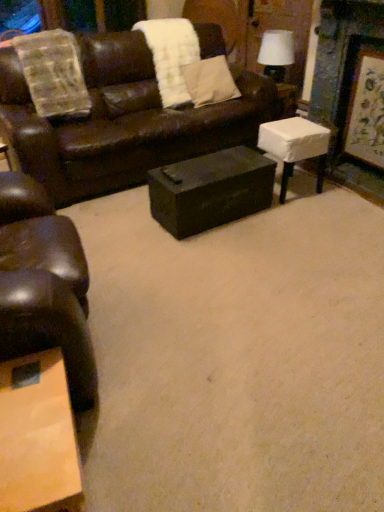
Image resolution: width=384 pixels, height=512 pixels. What do you see at coordinates (122, 121) in the screenshot?
I see `brown leather couch at upper center` at bounding box center [122, 121].

What do you see at coordinates (211, 190) in the screenshot? I see `matte black trunk at center, the second table when ordered from right to left` at bounding box center [211, 190].

What do you see at coordinates (276, 53) in the screenshot?
I see `white fabric lampshade at upper right` at bounding box center [276, 53].

This screenshot has width=384, height=512. In order to click on white fabric-covered stool at right, the 1th table viewed from the right in this screenshot , I will do `click(295, 146)`.

This screenshot has height=512, width=384. I want to click on shiny brown leather chair at left, so click(44, 284).

The height and width of the screenshot is (512, 384). In order to click on brown leather couch at upper center in this screenshot , I will do `click(122, 121)`.

In terms of width, does white fluffy blanket at upper center look wider or thinner when compared to shiny brown leather chair at left?

white fluffy blanket at upper center is wider than shiny brown leather chair at left.

Consider the image. Considering the relative positions of white fluffy blanket at upper center and shiny brown leather chair at left in the image provided, is white fluffy blanket at upper center in front of shiny brown leather chair at left?

No, it is not.

Considering the relative positions of white fluffy blanket at upper center and shiny brown leather chair at left in the image provided, is white fluffy blanket at upper center to the left of shiny brown leather chair at left from the viewer's perspective?

In fact, white fluffy blanket at upper center is to the right of shiny brown leather chair at left.

Is white fluffy blanket at upper center next to shiny brown leather chair at left?

No, white fluffy blanket at upper center is not beside shiny brown leather chair at left.

Is wooden framed artwork at right outside of white fabric lampshade at upper right?

Yes, wooden framed artwork at right is located beyond the bounds of white fabric lampshade at upper right.

From a real-world perspective, which object rests below the other?

wooden framed artwork at right is physically lower.

How far apart are wooden framed artwork at right and white fabric lampshade at upper right?

A distance of 37.02 inches exists between wooden framed artwork at right and white fabric lampshade at upper right.

In the scene shown: How different are the orientations of brown leather couch at upper center and matte black trunk at center, the second table when ordered from right to left, in degrees?

The angle between the facing direction of brown leather couch at upper center and the facing direction of matte black trunk at center, the second table when ordered from right to left, is 3.17 degrees.

Which is more to the right, brown leather couch at upper center or matte black trunk at center, positioned as the 1th table in left-to-right order?

From the viewer's perspective, matte black trunk at center, positioned as the 1th table in left-to-right order, appears more on the right side.

From a real-world perspective, relative to matte black trunk at center, positioned as the 1th table in left-to-right order, is brown leather couch at upper center vertically above or below?

brown leather couch at upper center is above matte black trunk at center, positioned as the 1th table in left-to-right order.

Are brown leather couch at upper center and matte black trunk at center, the second table when ordered from right to left, located far from each other?

No.

From the image's perspective, between shiny brown leather chair at left and white fluffy blanket at upper center, which one is located above?

white fluffy blanket at upper center.

Is white fluffy blanket at upper center a part of shiny brown leather chair at left?

No, white fluffy blanket at upper center is not a part of shiny brown leather chair at left.

From a real-world perspective, who is located higher, shiny brown leather chair at left or white fluffy blanket at upper center?

white fluffy blanket at upper center is physically above.

Is shiny brown leather chair at left further to the viewer compared to white fluffy blanket at upper center?

No, it is not.

Identify the location of throw pillow that is above the brown leather couch at upper center (from a real-world perspective). (209, 81).

From the image's perspective, who appears lower, beige fabric pillow at upper center or brown leather couch at upper center?

brown leather couch at upper center is shown below in the image.

Is the position of beige fabric pillow at upper center more distant than that of brown leather couch at upper center?

Yes, beige fabric pillow at upper center is behind brown leather couch at upper center.

From the image's perspective, who appears lower, wooden framed artwork at right or beige fabric pillow at upper center?

From the image's view, wooden framed artwork at right is below.

In the image, is wooden framed artwork at right positioned in front of or behind beige fabric pillow at upper center?

In the image, wooden framed artwork at right appears in front of beige fabric pillow at upper center.

Can we say wooden framed artwork at right lies outside beige fabric pillow at upper center?

wooden framed artwork at right is positioned outside beige fabric pillow at upper center.

Consider the image. Is wooden framed artwork at right at the left side of beige fabric pillow at upper center?

Incorrect, wooden framed artwork at right is not on the left side of beige fabric pillow at upper center.

Considering the relative sizes of beige fabric pillow at upper center and white fluffy blanket at upper center in the image provided, is beige fabric pillow at upper center shorter than white fluffy blanket at upper center?

Indeed, beige fabric pillow at upper center has a lesser height compared to white fluffy blanket at upper center.

Are beige fabric pillow at upper center and white fluffy blanket at upper center located far from each other?

beige fabric pillow at upper center is actually quite close to white fluffy blanket at upper center.

Is white fluffy blanket at upper center at the back of beige fabric pillow at upper center?

→ Yes.

Is beige fabric pillow at upper center outside of white fluffy blanket at upper center?

beige fabric pillow at upper center is positioned outside white fluffy blanket at upper center.

Identify the location of chair that appears below the white fluffy blanket at upper center (from a real-world perspective). This screenshot has width=384, height=512. (44, 284).

You are a GUI agent. You are given a task and a screenshot of the screen. Output one action in this format:
    pyautogui.click(x=<x>, y=<y>)
    Task: Click on the picture frame on the right of white fabric lampshade at upper right
    
    Given the screenshot: What is the action you would take?
    pyautogui.click(x=366, y=111)

From the image, which object appears to be nearer to white fluffy blanket at upper center, matte black trunk at center, positioned as the 1th table in left-to-right order, or white fabric-covered stool at right, the second table in the left-to-right sequence?

white fabric-covered stool at right, the second table in the left-to-right sequence, is positioned closer to the anchor white fluffy blanket at upper center.

Based on their spatial positions, is beige fabric pillow at upper center or wooden coffee table at lower left further from white fluffy blanket at upper center?

wooden coffee table at lower left is positioned further to the anchor white fluffy blanket at upper center.

From the image, which object appears to be nearer to matte black trunk at center, the second table when ordered from right to left, white fluffy blanket at upper center or brown leather couch at upper center?

brown leather couch at upper center is closer to matte black trunk at center, the second table when ordered from right to left.

Consider the image. When comparing their distances from white fluffy blanket at upper center, does matte black trunk at center, the second table when ordered from right to left, or brown leather couch at upper center seem further?

matte black trunk at center, the second table when ordered from right to left.

Based on their spatial positions, is brown leather couch at upper center or white fabric-covered stool at right, the second table in the left-to-right sequence, further from white fluffy blanket at upper center?

white fabric-covered stool at right, the second table in the left-to-right sequence.

Based on their spatial positions, is white fabric lampshade at upper right or beige fabric pillow at upper center closer to matte black trunk at center, the second table when ordered from right to left?

beige fabric pillow at upper center.

Based on their spatial positions, is white fabric-covered stool at right, the 1th table viewed from the right, or matte black trunk at center, positioned as the 1th table in left-to-right order, closer to brown leather couch at upper center?

matte black trunk at center, positioned as the 1th table in left-to-right order, lies closer to brown leather couch at upper center than the other object.

Estimate the real-world distances between objects in this image. Which object is further from white fluffy blanket at upper center, wooden framed artwork at right or brown leather couch at upper center?

The object further to white fluffy blanket at upper center is wooden framed artwork at right.

Where is `throw pillow between matte black trunk at center, positioned as the 1th table in left-to-right order, and wooden framed artwork at right`? This screenshot has height=512, width=384. throw pillow between matte black trunk at center, positioned as the 1th table in left-to-right order, and wooden framed artwork at right is located at coordinates (209, 81).

Find the location of a particular element. throw pillow between brown leather couch at upper center and white fabric lampshade at upper right from front to back is located at coordinates (209, 81).

At what (x,y) coordinates should I click in order to perform the action: click on blanket located between wooden coffee table at lower left and beige fabric pillow at upper center in the depth direction. Please return your answer as a coordinate pair (x, y). Looking at the image, I should click on (171, 56).

Find the location of a particular element. chair positioned between wooden coffee table at lower left and white fluffy blanket at upper center from near to far is located at coordinates (44, 284).